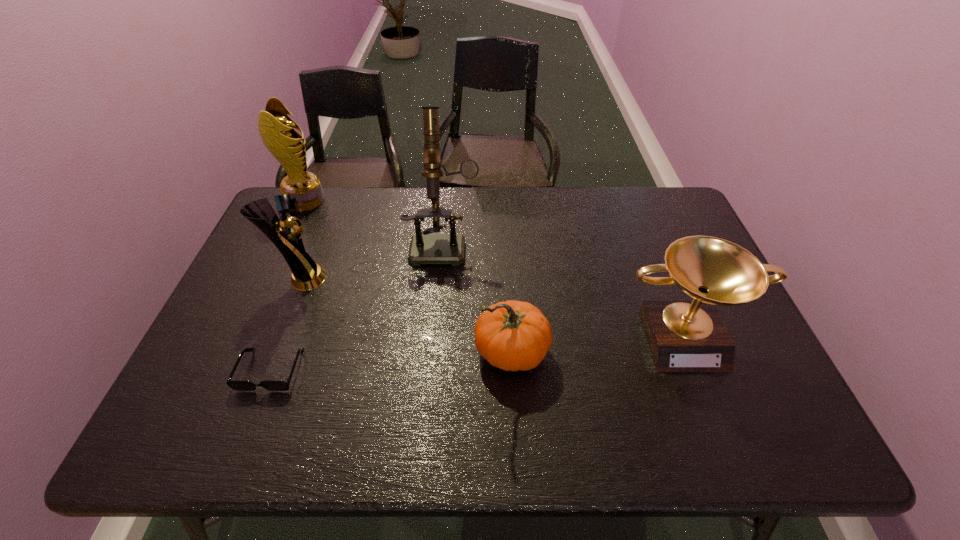
In order to click on empty space between the sunglasses and the microscope in this screenshot , I will do `click(357, 306)`.

What are the coordinates of `unoccupied position between the rightmost award and the tallest award` in the screenshot? It's located at (493, 267).

Find the location of a particular element. vacant space that's between the shortest object and the second shortest award is located at coordinates (286, 324).

Locate an element on the screen. vacant area that lies between the nearest award and the sunglasses is located at coordinates (476, 352).

Locate which object is the fourth closest to the farthest object. Please provide its 2D coordinates. Your answer should be formatted as a tuple, i.e. [(x, y)], where the tuple contains the x and y coordinates of a point satisfying the conditions above.

[(512, 335)]

Point out which object is positioned as the third nearest to the shortest object. Please provide its 2D coordinates. Your answer should be formatted as a tuple, i.e. [(x, y)], where the tuple contains the x and y coordinates of a point satisfying the conditions above.

[(512, 335)]

Find the location of a particular element. award identified as the closest to the farthest award is located at coordinates (306, 275).

This screenshot has height=540, width=960. I want to click on the second closest award to the pumpkin, so (x=306, y=275).

Where is `free spot that satisfies the following two spatial constraints: 1. on the front-facing side of the pumpkin; 2. on the right side of the second tallest object`? The width and height of the screenshot is (960, 540). free spot that satisfies the following two spatial constraints: 1. on the front-facing side of the pumpkin; 2. on the right side of the second tallest object is located at coordinates (236, 353).

What are the coordinates of `free location that satisfies the following two spatial constraints: 1. at the front of the second farthest award, where the globe is visible; 2. on the left side of the pumpkin` in the screenshot? It's located at (273, 353).